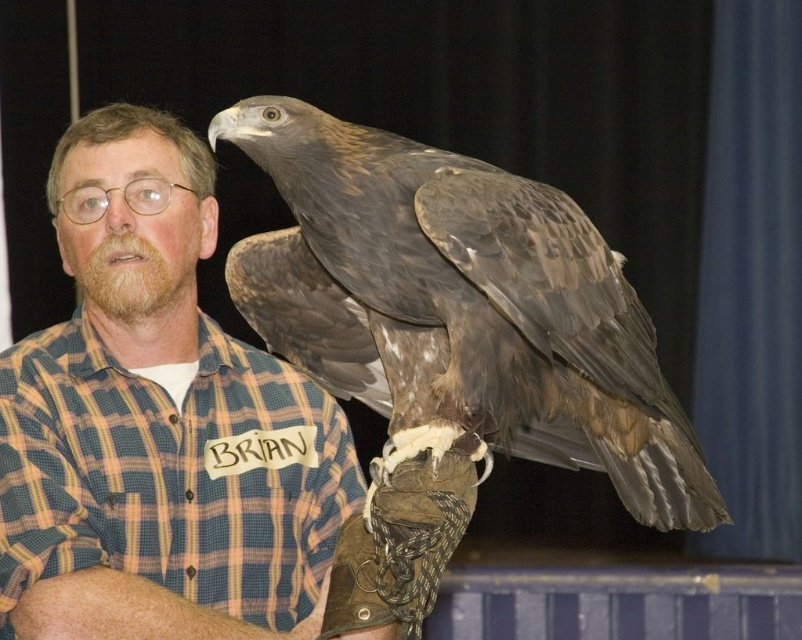
Question: Can you confirm if plaid shirt at center is positioned above plaid cotton shirt at center?

Choices:
 (A) yes
 (B) no

Answer: (A)

Question: Estimate the real-world distances between objects in this image. Which object is closer to the plaid shirt at center?

Choices:
 (A) plaid cotton shirt at center
 (B) brown feathered falcon at upper right

Answer: (A)

Question: From the image, what is the correct spatial relationship of plaid shirt at center in relation to plaid cotton shirt at center?

Choices:
 (A) right
 (B) left

Answer: (A)

Question: Is plaid shirt at center to the right of plaid cotton shirt at center from the viewer's perspective?

Choices:
 (A) no
 (B) yes

Answer: (B)

Question: Which point appears farthest from the camera in this image?

Choices:
 (A) (211, 470)
 (B) (33, 529)

Answer: (A)

Question: Which object appears farthest from the camera in this image?

Choices:
 (A) plaid shirt at center
 (B) plaid cotton shirt at center

Answer: (B)